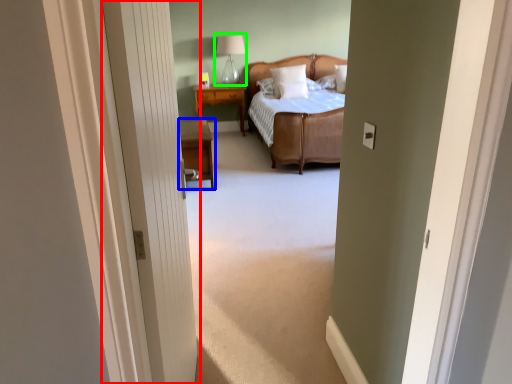
Question: Estimate the real-world distances between objects in this image. Which object is closer to door (highlighted by a red box), nightstand (highlighted by a blue box) or table lamp (highlighted by a green box)?

Choices:
 (A) nightstand
 (B) table lamp

Answer: (A)